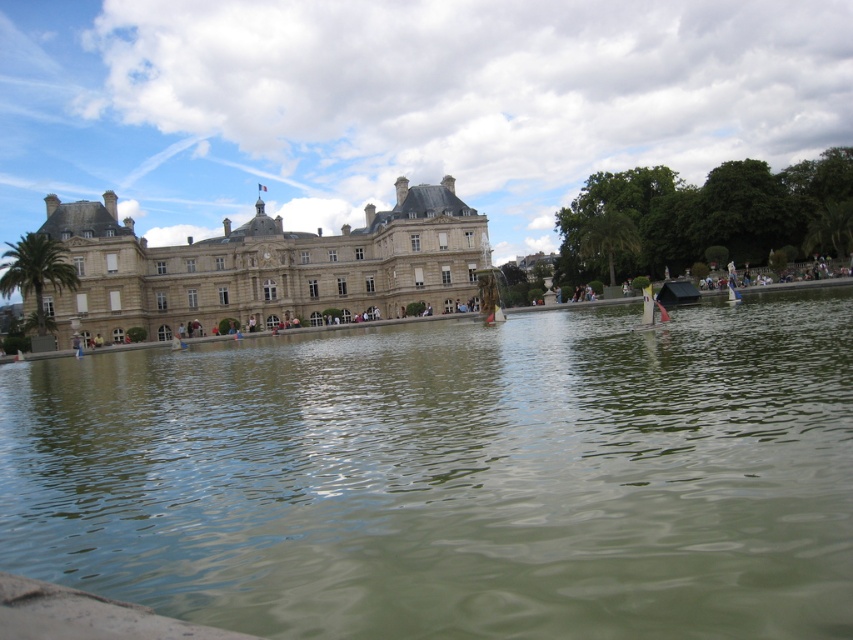
You are standing in front of the historic building by the water. You notice two points marked on the building facade. The first point is at coordinates point (x=631, y=593) and the second is at point (x=322, y=269). Which point is closer to your current position?

Point (x=631, y=593) is closer to the camera than point (x=322, y=269), so the first point is closer to your current position.

You are standing on the dock and want to know where the greenish water at center is located. Can you tell me its exact coordinates?

The greenish water at center is located at coordinates point (454, 476).

You are a tourist standing on the left side of the brown stone palace at center. You want to take a photo of the French flag on top of the building while also capturing the greenish water at center in the reflection. Which direction should you face to include both the flag and the water in your shot?

You should face to the right of the brown stone palace at center. Since the greenish water at center is to the right of the palace, facing that direction will allow you to capture both the French flag on top of the palace and its reflection in the greenish water at center.